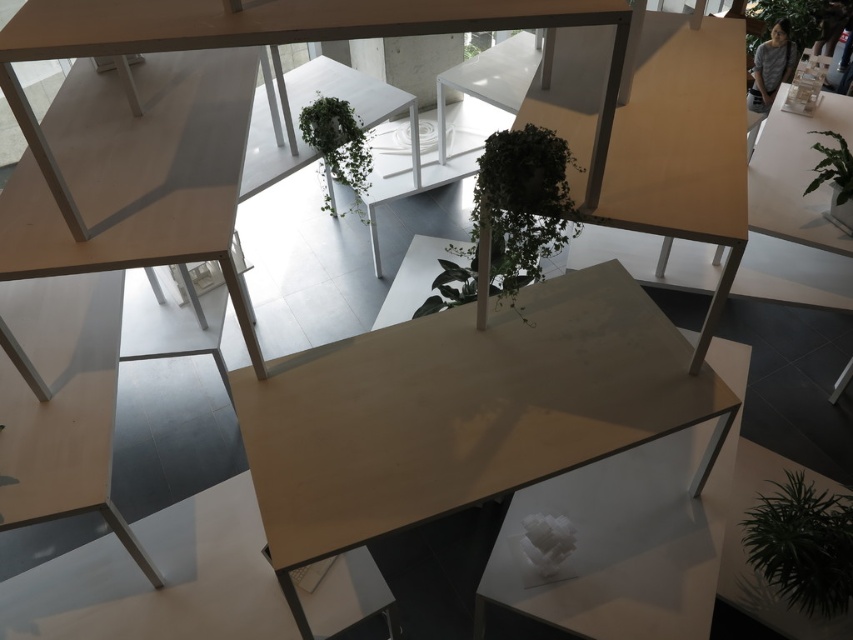
Is point (827, 4) behind point (810, 131)?

Yes, it is behind point (810, 131).

Based on the photo, which is below, green leafy plant at upper right or green leafy plant at right?

green leafy plant at right is below.

At what (x,y) coordinates should I click in order to perform the action: click on green leafy plant at upper right. Please return your answer as a coordinate pair (x, y). The height and width of the screenshot is (640, 853). Looking at the image, I should click on (793, 19).

You are a GUI agent. You are given a task and a screenshot of the screen. Output one action in this format:
    pyautogui.click(x=<x>, y=<y>)
    Task: Click on the green leafy plant at upper right
    The width and height of the screenshot is (853, 640).
    Given the screenshot: What is the action you would take?
    pyautogui.click(x=793, y=19)

Is matte wooden table at center positioned behind green leafy plant at upper right?

No, matte wooden table at center is in front of green leafy plant at upper right.

Does point (614, 404) lie behind point (793, 3)?

No.

Is point (637, 372) in front of point (763, 29)?

Yes, it is.

Find the location of a particular element. The image size is (853, 640). matte wooden table at center is located at coordinates (463, 412).

Does point (773, 493) lie in front of point (821, 29)?

Yes.

Does green leafy plant at lower right have a greater width compared to green leafy plant at upper right?

No, green leafy plant at lower right is not wider than green leafy plant at upper right.

Does point (773, 593) come farther from viewer compared to point (758, 6)?

No, it is in front of (758, 6).

I want to click on green leafy plant at lower right, so [x=801, y=545].